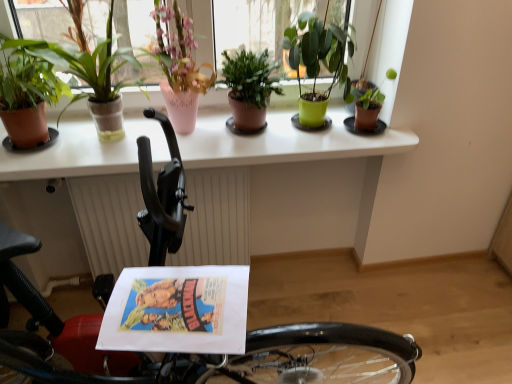
I want to click on vacant space underneath terracotta pot plant at left, the 5th houseplant when ordered from right to left (from a real-world perspective), so click(101, 142).